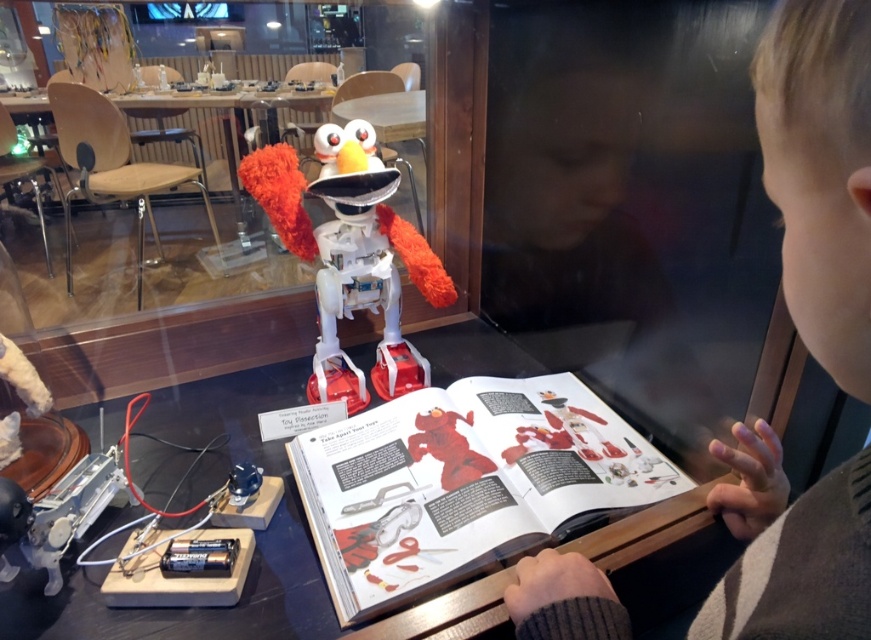
You are standing in front of the robotic Elmo display. There are two points on the display table labeled as point 1 at coordinates (414, 444) and point 2 at coordinates (383, 188). If you want to place a small sticker closer to the camera, which point should you choose?

Point 1 at coordinates (414, 444) is closer to the camera than point 2 at coordinates (383, 188), so you should place the sticker there.

You are a photographer trying to capture a photo of the black plastic table at center and the blonde hair boy at upper right. If you want to make sure both subjects are in focus, which one should you adjust your camera focus on first?

The blonde hair boy at upper right is smaller than the black plastic table at center, so you should focus on the smaller subject first to ensure both are in focus.

You are standing in front of the museum exhibit and notice two points marked on the display table. The first point is at coordinate point (820,64) and the second is at point (275,579). Which point is closer to you?

Point (820,64) is closer to the viewer than point (275,579).